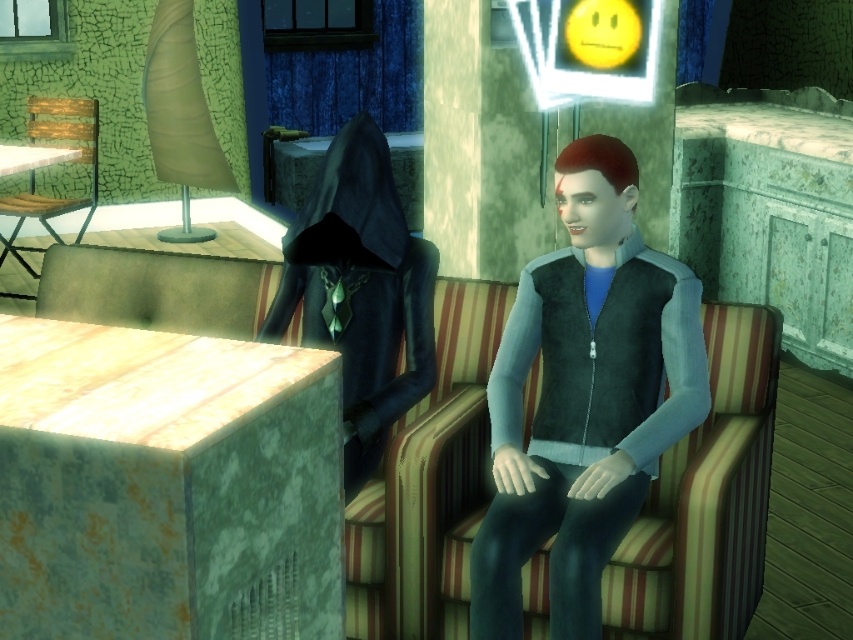
Looking at this image, is smooth black vest at center positioned behind wooden slats chair at left?

No, smooth black vest at center is in front of wooden slats chair at left.

Identify the location of smooth black vest at center. This screenshot has height=640, width=853. (584, 396).

Can you confirm if smooth black vest at center is positioned above matte brown cushion at left?

Incorrect, smooth black vest at center is not positioned above matte brown cushion at left.

Measure the distance between point (495, 614) and camera.

Point (495, 614) is 3.86 meters from camera.

At what (x,y) coordinates should I click in order to perform the action: click on smooth black vest at center. Please return your answer as a coordinate pair (x, y). The height and width of the screenshot is (640, 853). Looking at the image, I should click on (584, 396).

Does matte black suit at center lie in front of wooden slats chair at left?

Yes.

Is matte black suit at center below wooden slats chair at left?

Yes.

Does point (396, 308) lie behind point (51, 196)?

No, (396, 308) is in front of (51, 196).

The image size is (853, 640). I want to click on matte black suit at center, so click(360, 291).